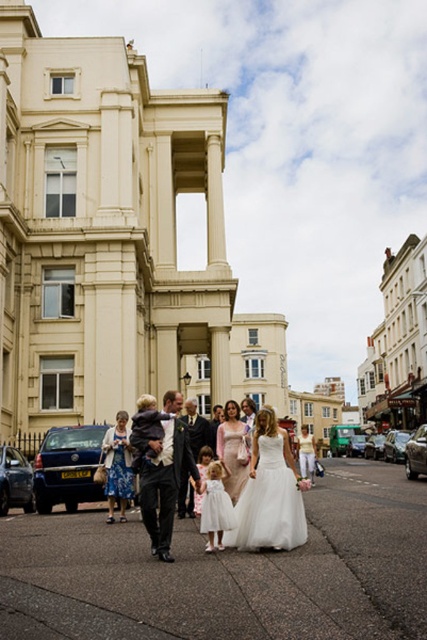
Question: Based on their relative distances, which object is farther from the blue floral dress at center?

Choices:
 (A) dark gray suit at center
 (B) white tulle dress at center
 (C) satin white dress at center

Answer: (B)

Question: Which point is farther to the camera?

Choices:
 (A) (181, 472)
 (B) (225, 416)

Answer: (B)

Question: Is satin white dress at center to the right of white satin dress at center from the viewer's perspective?

Choices:
 (A) no
 (B) yes

Answer: (B)

Question: Considering the real-world distances, which object is farthest from the blue floral dress at center?

Choices:
 (A) white tulle dress at center
 (B) satin white dress at center

Answer: (A)

Question: Considering the relative positions of matte white dress at center and white satin dress at center in the image provided, where is matte white dress at center located with respect to white satin dress at center?

Choices:
 (A) below
 (B) above

Answer: (B)

Question: Is blue floral dress at center smaller than satin white dress at center?

Choices:
 (A) yes
 (B) no

Answer: (A)